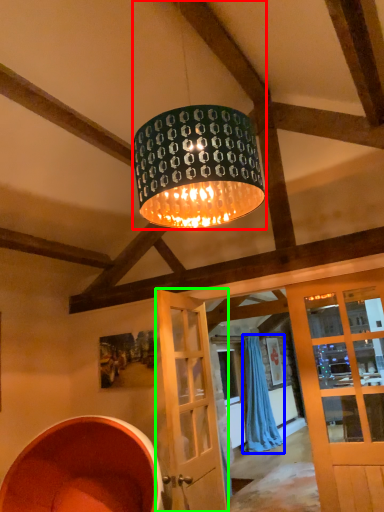
Question: Based on their relative distances, which object is farther from lamp (highlighted by a red box)? Choose from curtain (highlighted by a blue box) and door (highlighted by a green box).

Choices:
 (A) curtain
 (B) door

Answer: (A)